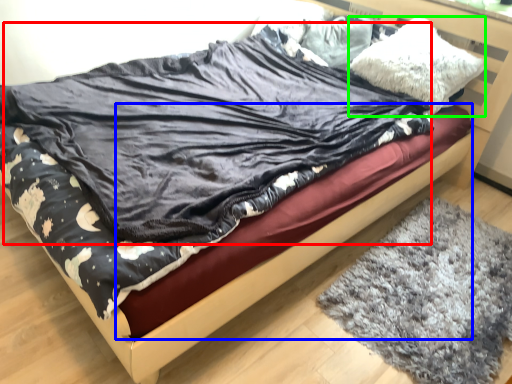
Question: Which is farther away from blanket (highlighted by a red box)? bed frame (highlighted by a blue box) or pillow (highlighted by a green box)?

Choices:
 (A) bed frame
 (B) pillow

Answer: (B)